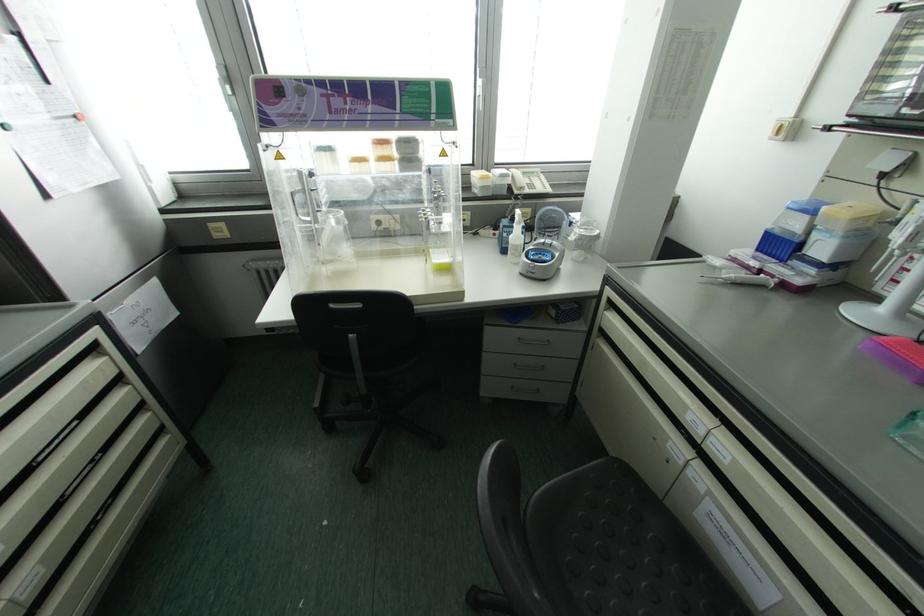
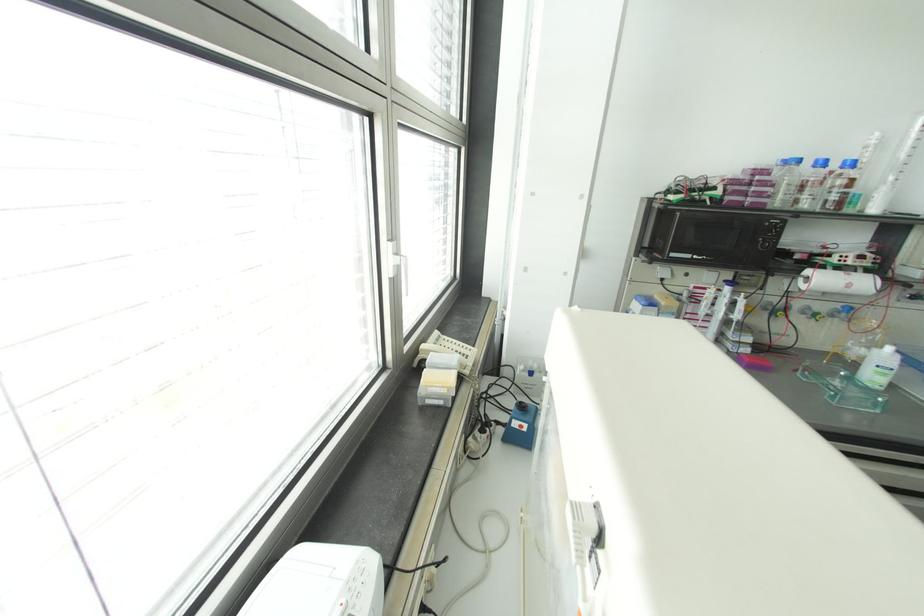
Question: I am providing you with two images of the same scene from different viewpoints. After the viewpoint changes to image2, which objects are now occluded?

Choices:
 (A) white wash bottle
 (B) recessed drawer handle
 (C) black sandal
 (D) bottle with blue cap

Answer: (B)